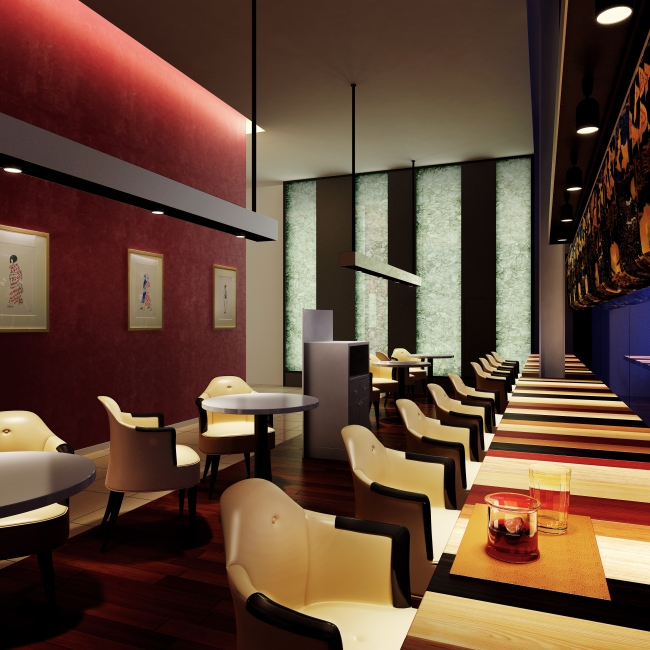
Where is `artwork`? Image resolution: width=650 pixels, height=650 pixels. artwork is located at coordinates (19, 273), (147, 287), (224, 305).